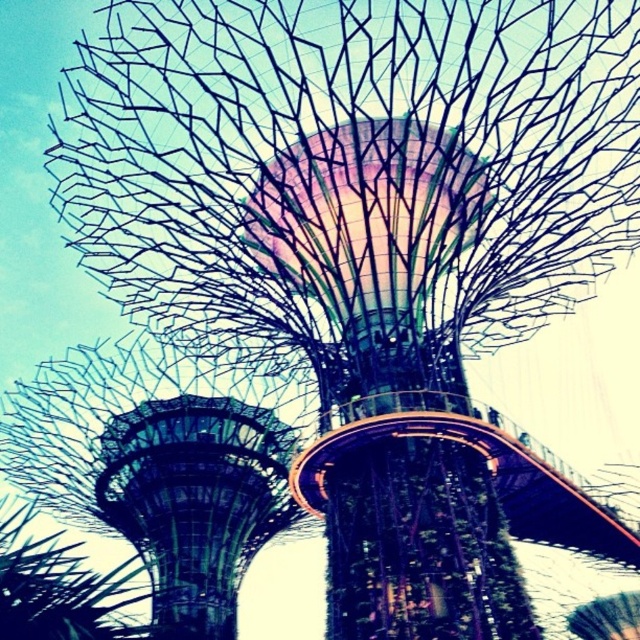
Which is above, green glass tower at lower left or metallic wireframe tree at lower left?

green glass tower at lower left is above.

Where is `green glass tower at lower left`? The image size is (640, 640). green glass tower at lower left is located at coordinates (195, 502).

I want to click on green glass tower at lower left, so click(195, 502).